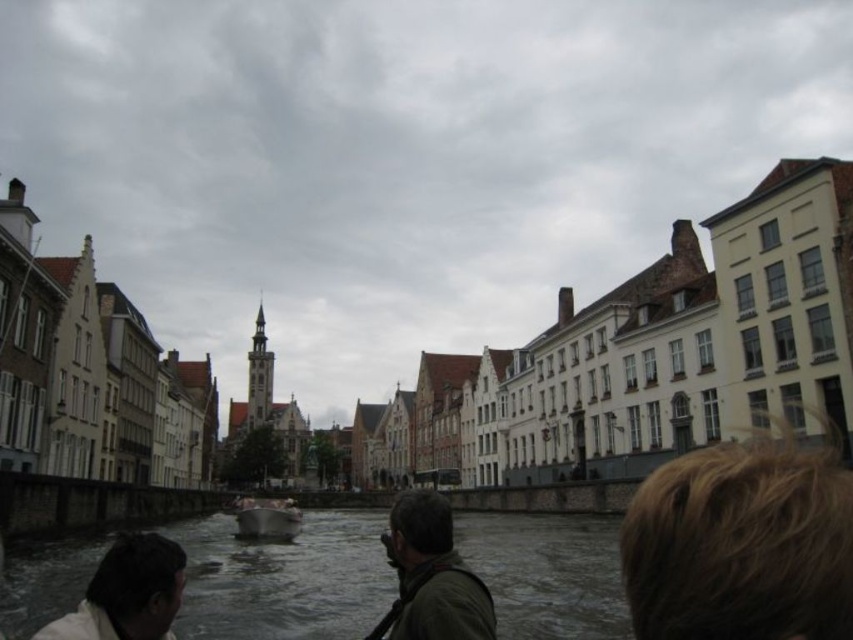
Question: Among these objects, which one is nearest to the camera?

Choices:
 (A) gray water at center
 (B) dark brown hair at lower left
 (C) dark green fabric at center

Answer: (B)

Question: Is gray water at center thinner than blonde hair at upper right?

Choices:
 (A) no
 (B) yes

Answer: (A)

Question: In this image, where is gray water at center located relative to metallic gray boat at center?

Choices:
 (A) above
 (B) below

Answer: (A)

Question: Which of the following is the closest to the observer?

Choices:
 (A) dark brown hair at lower left
 (B) dark green fabric at center
 (C) gray water at center

Answer: (A)

Question: Is gray water at center thinner than blonde hair at upper right?

Choices:
 (A) yes
 (B) no

Answer: (B)

Question: Considering the real-world distances, which object is farthest from the blonde hair at upper right?

Choices:
 (A) dark brown hair at lower left
 (B) gray water at center

Answer: (A)